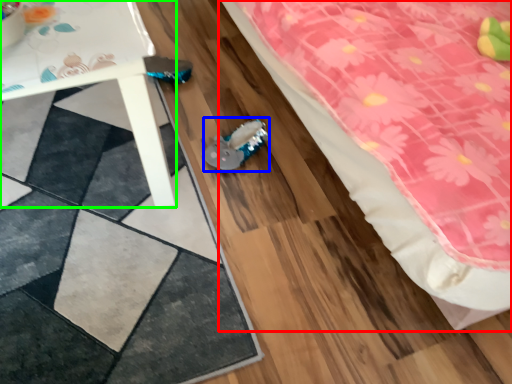
Question: Based on their relative distances, which object is farther from bed (highlighted by a red box)? Choose from stuff (highlighted by a blue box) and table (highlighted by a green box).

Choices:
 (A) stuff
 (B) table

Answer: (B)